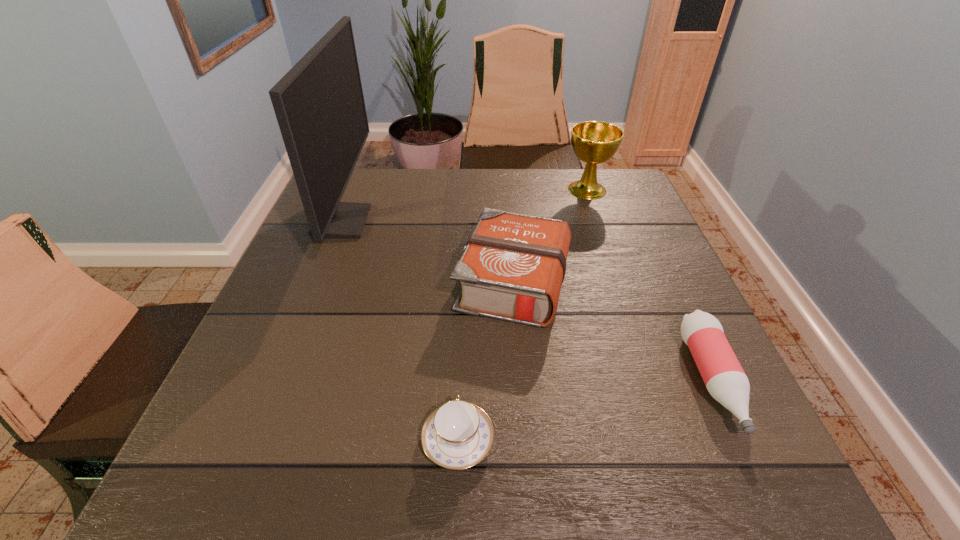
Locate an element on the screen. This screenshot has height=540, width=960. blank space that satisfies the following two spatial constraints: 1. on the front-facing side of the computer monitor; 2. on the left side of the third tallest object is located at coordinates point(318,282).

Where is `vacant space that satisfies the following two spatial constraints: 1. on the side with the handle of the shortest object; 2. on the front-facing side of the leftmost object`? This screenshot has width=960, height=540. vacant space that satisfies the following two spatial constraints: 1. on the side with the handle of the shortest object; 2. on the front-facing side of the leftmost object is located at coordinates (467, 222).

Locate an element on the screen. Image resolution: width=960 pixels, height=540 pixels. free spot that satisfies the following two spatial constraints: 1. on the front-facing side of the Bible; 2. on the right side of the computer monitor is located at coordinates (318, 282).

Find the location of a particular element. blank space that satisfies the following two spatial constraints: 1. on the side with the handle of the teacup; 2. on the right side of the Bible is located at coordinates (465, 282).

This screenshot has width=960, height=540. Find the location of `free space that satisfies the following two spatial constraints: 1. on the back side of the Bible; 2. on the front-facing side of the tallest object`. free space that satisfies the following two spatial constraints: 1. on the back side of the Bible; 2. on the front-facing side of the tallest object is located at coordinates (508, 222).